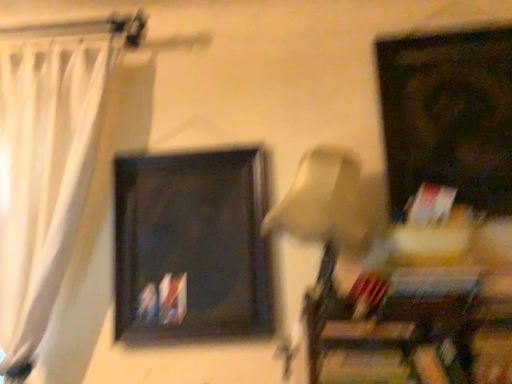
Question: Is beige fabric lampshade at center inside or outside of white sheer curtain at left?

Choices:
 (A) inside
 (B) outside

Answer: (B)

Question: Considering the positions of beige fabric lampshade at center and white sheer curtain at left in the image, is beige fabric lampshade at center bigger or smaller than white sheer curtain at left?

Choices:
 (A) small
 (B) big

Answer: (A)

Question: Estimate the real-world distances between objects in this image. Which object is closer to the matte black picture frame at upper right, which appears as the 2th picture frame when viewed from the left?

Choices:
 (A) white sheer curtain at left
 (B) beige fabric lampshade at center
 (C) matte black picture frame at center, which ranks as the 1th picture frame in left-to-right order

Answer: (B)

Question: Considering the real-world distances, which object is closest to the white sheer curtain at left?

Choices:
 (A) matte black picture frame at center, which is the 2th picture frame in right-to-left order
 (B) beige fabric lampshade at center
 (C) matte black picture frame at upper right, which ranks as the 1th picture frame in right-to-left order

Answer: (A)